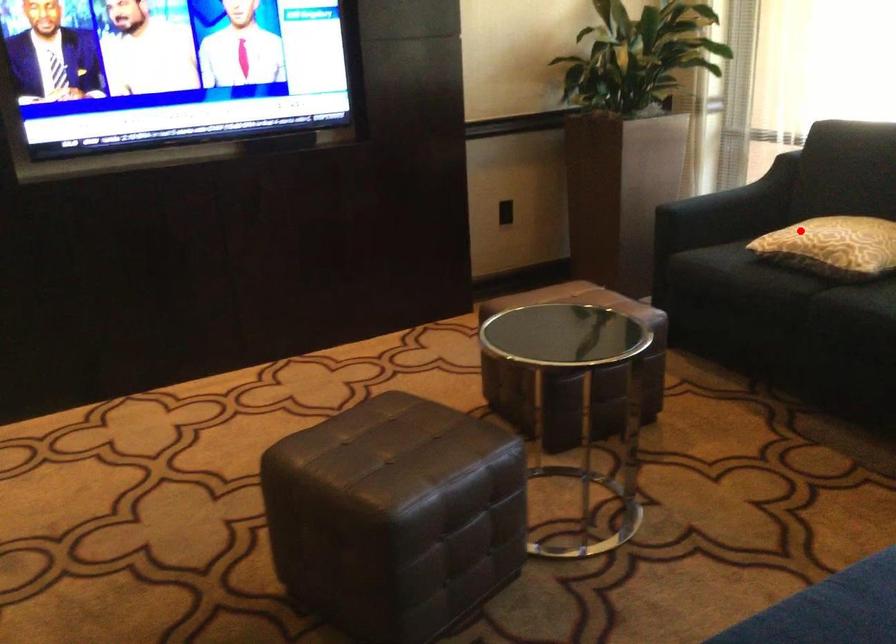
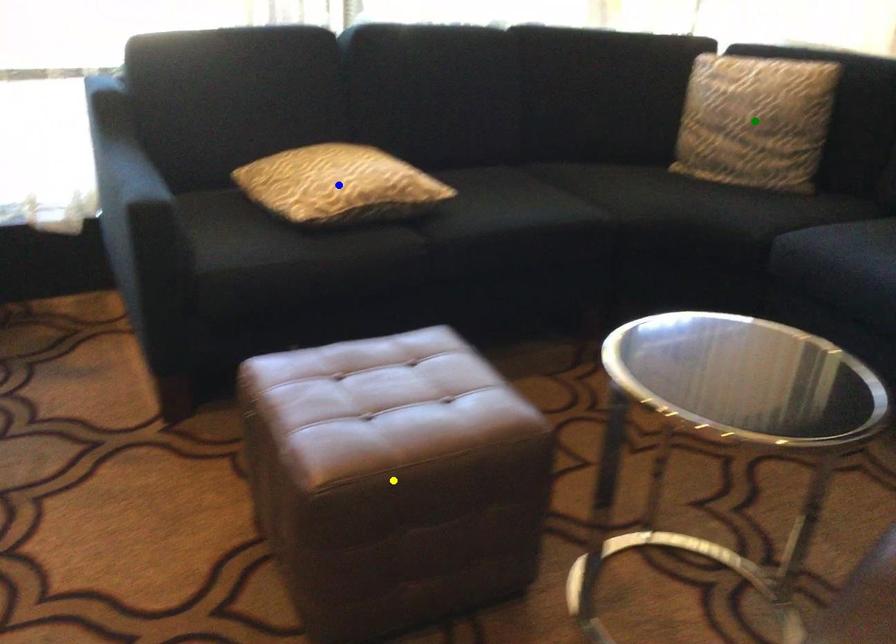
Question: I am providing you with two images of the same scene from different viewpoints. A red point is marked on the first image. You are given multiple points on the second image. Which spot in image 2 lines up with the point in image 1?

Choices:
 (A) blue point
 (B) yellow point
 (C) green point

Answer: (A)